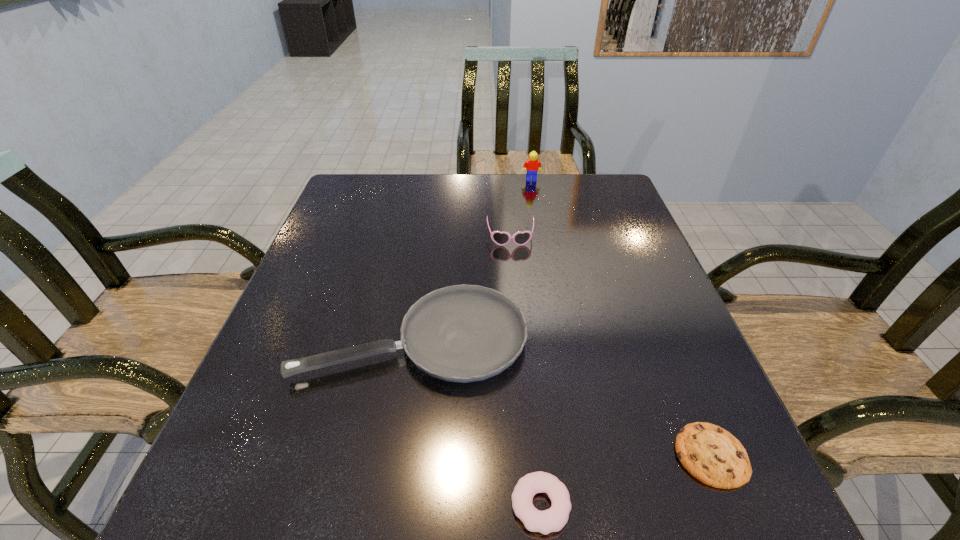
The height and width of the screenshot is (540, 960). I want to click on unoccupied position between the doughnut and the Lego, so click(536, 342).

Locate an element on the screen. vacant region between the shortest object and the frying pan is located at coordinates (563, 397).

I want to click on vacant area that lies between the shortest object and the fourth tallest object, so click(626, 480).

Select which object is the closest to the sunglasses. Please provide its 2D coordinates. Your answer should be formatted as a tuple, i.e. [(x, y)], where the tuple contains the x and y coordinates of a point satisfying the conditions above.

[(463, 333)]

Select which object appears as the fourth closest to the Lego. Please provide its 2D coordinates. Your answer should be formatted as a tuple, i.e. [(x, y)], where the tuple contains the x and y coordinates of a point satisfying the conditions above.

[(553, 519)]

The height and width of the screenshot is (540, 960). Identify the location of blank area in the image that satisfies the following two spatial constraints: 1. on the front-facing side of the shortest object; 2. on the right side of the farthest object. (x=581, y=455).

You are a GUI agent. You are given a task and a screenshot of the screen. Output one action in this format:
    pyautogui.click(x=<x>, y=<y>)
    Task: Click on the free spot that satisfies the following two spatial constraints: 1. on the front-facing side of the rightmost object; 2. on the left side of the farthest object
    The height and width of the screenshot is (540, 960).
    Given the screenshot: What is the action you would take?
    pyautogui.click(x=581, y=455)

In order to click on vacant area in the image that satisfies the following two spatial constraints: 1. on the front-facing side of the sunglasses; 2. on the left side of the cookie in this screenshot , I will do `click(530, 455)`.

Locate an element on the screen. The image size is (960, 540). vacant space that satisfies the following two spatial constraints: 1. on the front-facing side of the shortest object; 2. on the left side of the Lego is located at coordinates (581, 455).